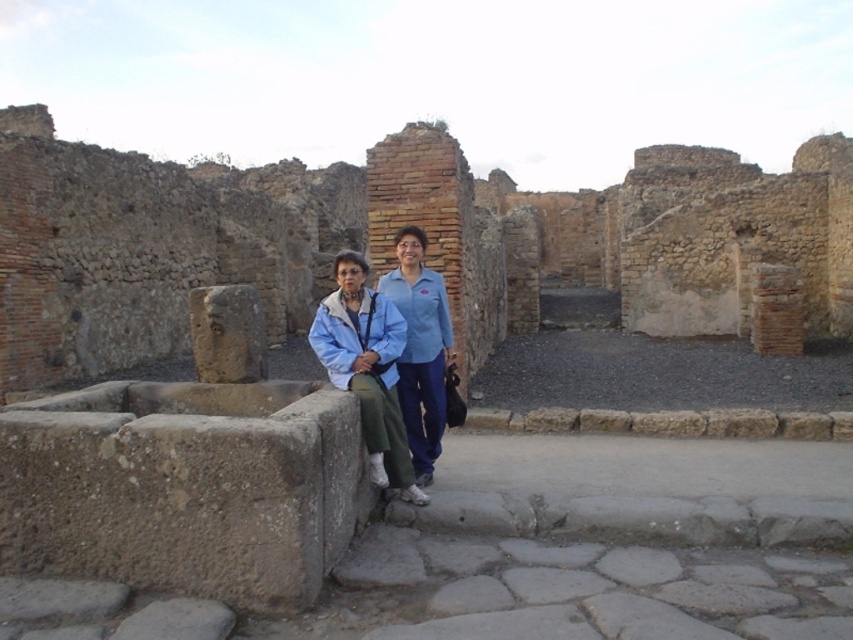
Question: Which point is closer to the camera taking this photo?

Choices:
 (A) (387, 360)
 (B) (22, 374)

Answer: (A)

Question: Among these points, which one is farthest from the camera?

Choices:
 (A) (18, 275)
 (B) (401, 472)

Answer: (A)

Question: Is brick wall at center closer to camera compared to blue fabric jacket at center?

Choices:
 (A) yes
 (B) no

Answer: (B)

Question: Does brick wall at center have a lesser width compared to blue fabric jacket at center?

Choices:
 (A) no
 (B) yes

Answer: (A)

Question: Does brick wall at center have a lesser width compared to blue fabric jacket at center?

Choices:
 (A) yes
 (B) no

Answer: (B)

Question: Which point is closer to the camera?

Choices:
 (A) 515,259
 (B) 364,372

Answer: (B)